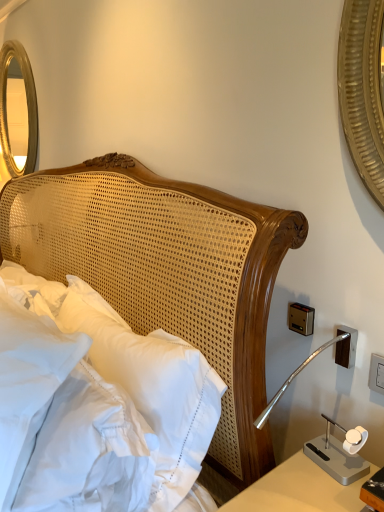
Question: Is gold metallic mirror at upper left in front of or behind white woven headboard at center in the image?

Choices:
 (A) front
 (B) behind

Answer: (B)

Question: Considering the positions of gold metallic mirror at upper left and white woven headboard at center in the image, is gold metallic mirror at upper left bigger or smaller than white woven headboard at center?

Choices:
 (A) big
 (B) small

Answer: (B)

Question: Considering the real-world distances, which object is closest to the white plastic electric outlet at right?

Choices:
 (A) white woven headboard at center
 (B) white soft pillow at left
 (C) gold metallic mirror at upper left

Answer: (B)

Question: Which object is the closest to the white soft pillow at left?

Choices:
 (A) gold metallic mirror at upper left
 (B) white plastic electric outlet at right
 (C) white woven headboard at center

Answer: (C)